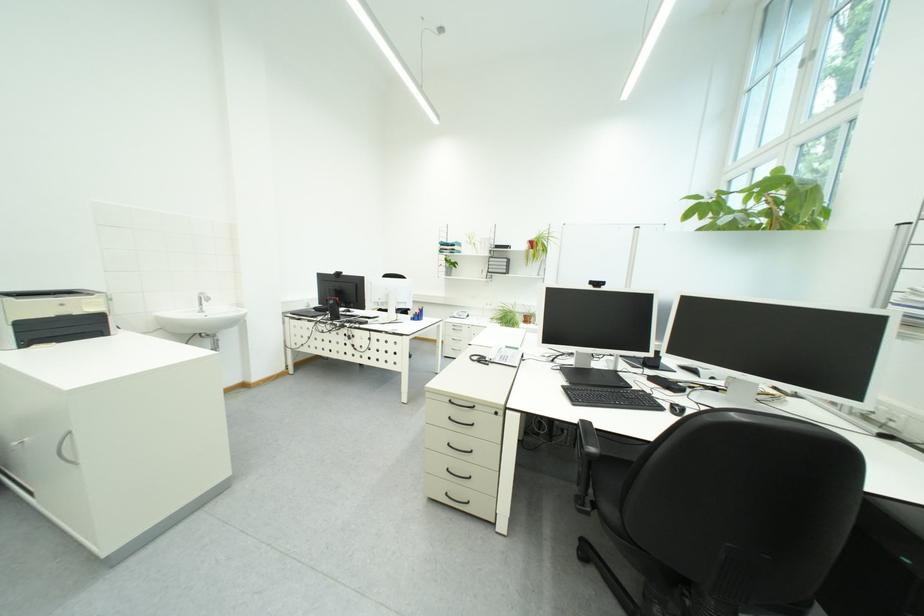
Locate an element on the screen. black chair sitting surface is located at coordinates (608, 480).